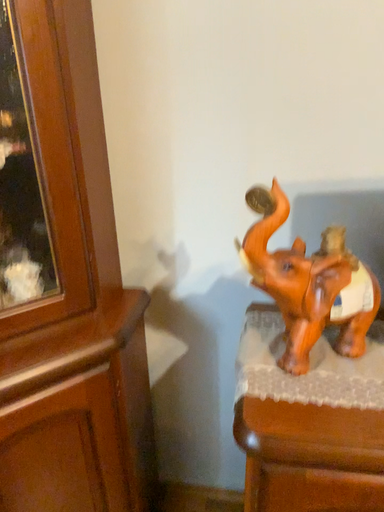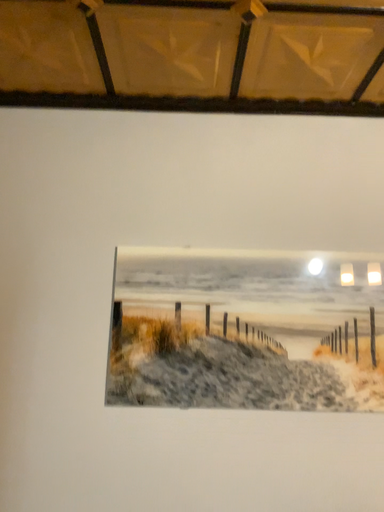
Question: How did the camera likely rotate when shooting the video?

Choices:
 (A) rotated right
 (B) rotated left

Answer: (A)